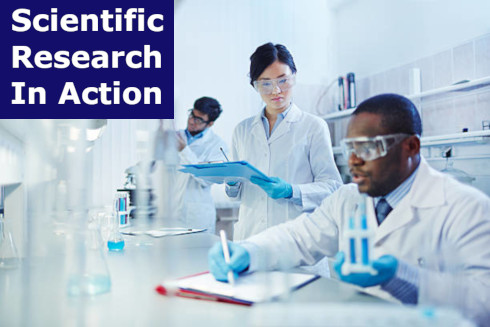
Locate an element on the screen. folder is located at coordinates (223, 164).